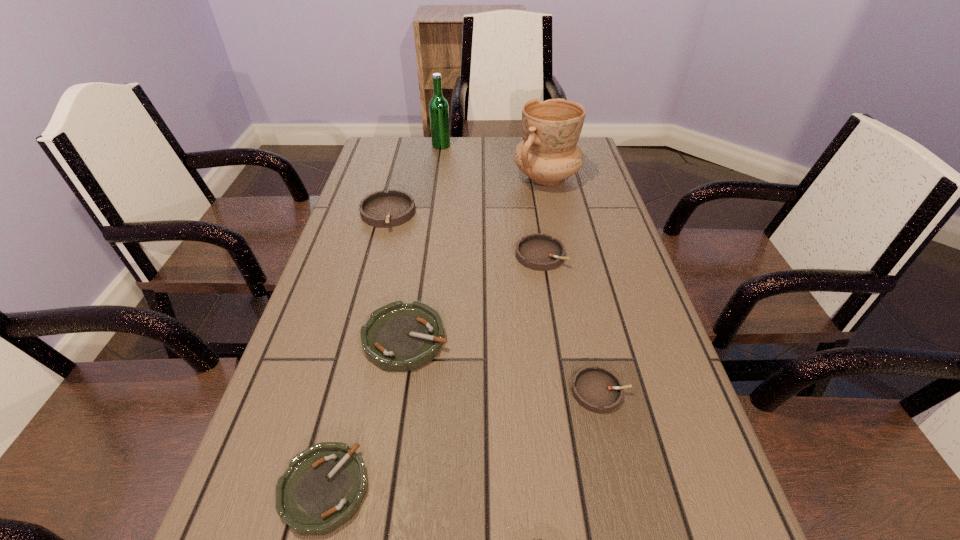
Where is `pottery positioned at the far edge`? pottery positioned at the far edge is located at coordinates tap(548, 154).

In order to click on pottery that is at the right edge in this screenshot , I will do `click(548, 154)`.

Find the location of `object present at the far right corner`. object present at the far right corner is located at coordinates (548, 154).

Identify the location of free region at the far edge. (505, 139).

Locate an element on the screen. This screenshot has height=540, width=960. vacant point at the left edge is located at coordinates (380, 264).

Locate an element on the screen. The height and width of the screenshot is (540, 960). vacant region at the right edge is located at coordinates (643, 360).

Where is `free space at the far left corner of the desktop`? This screenshot has width=960, height=540. free space at the far left corner of the desktop is located at coordinates (392, 156).

This screenshot has height=540, width=960. Find the location of `blank region between the pottery and the farthest gray ashtray`. blank region between the pottery and the farthest gray ashtray is located at coordinates (467, 195).

Where is `vacant area that lies between the smallest gray ashtray and the nearest ashtray`? The height and width of the screenshot is (540, 960). vacant area that lies between the smallest gray ashtray and the nearest ashtray is located at coordinates 463,440.

Find the location of a particular element. The image size is (960, 540). empty location between the second biggest gray ashtray and the smaller green ashtray is located at coordinates (432, 372).